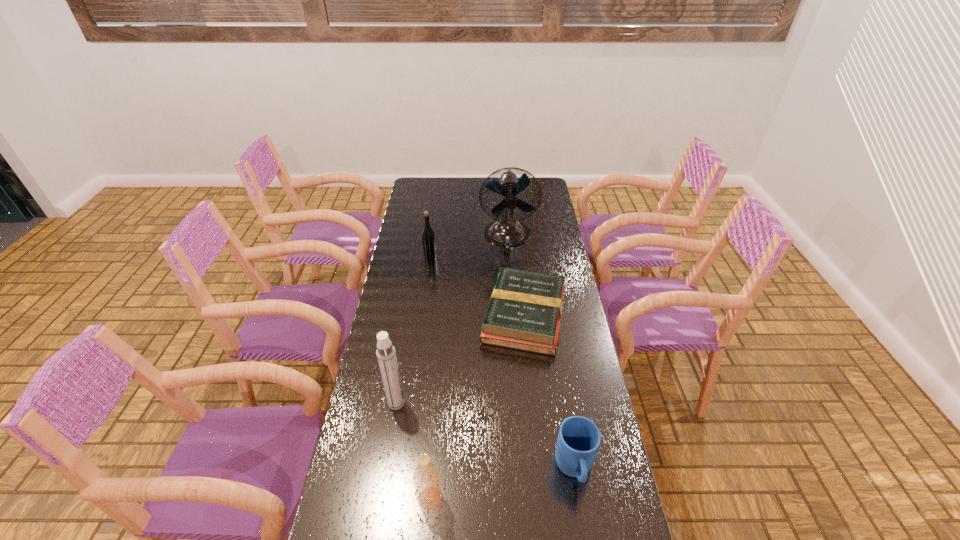
Find the location of a particular element. The height and width of the screenshot is (540, 960). fan is located at coordinates (506, 231).

Find the location of a particular element. Image resolution: width=960 pixels, height=540 pixels. the farthest object is located at coordinates (506, 231).

Find the location of a particular element. Image resolution: width=960 pixels, height=540 pixels. the second tallest object is located at coordinates (386, 355).

This screenshot has height=540, width=960. Find the location of `the third nearest object`. the third nearest object is located at coordinates (386, 355).

Identify the location of the farther beer bottle. (428, 237).

Identify the location of the left beer bottle. The image size is (960, 540). 428,237.

At what (x,y) coordinates should I click in order to perform the action: click on the nearer beer bottle. Please return your answer as a coordinate pair (x, y). Looking at the image, I should click on (426, 476).

Find the location of `the right beer bottle`. the right beer bottle is located at coordinates (426, 476).

Where is `the fifth tallest object`? This screenshot has width=960, height=540. the fifth tallest object is located at coordinates (579, 438).

At what (x,y) coordinates should I click in order to perform the action: click on the third farthest object. Please return your answer as a coordinate pair (x, y). This screenshot has height=540, width=960. Looking at the image, I should click on (524, 313).